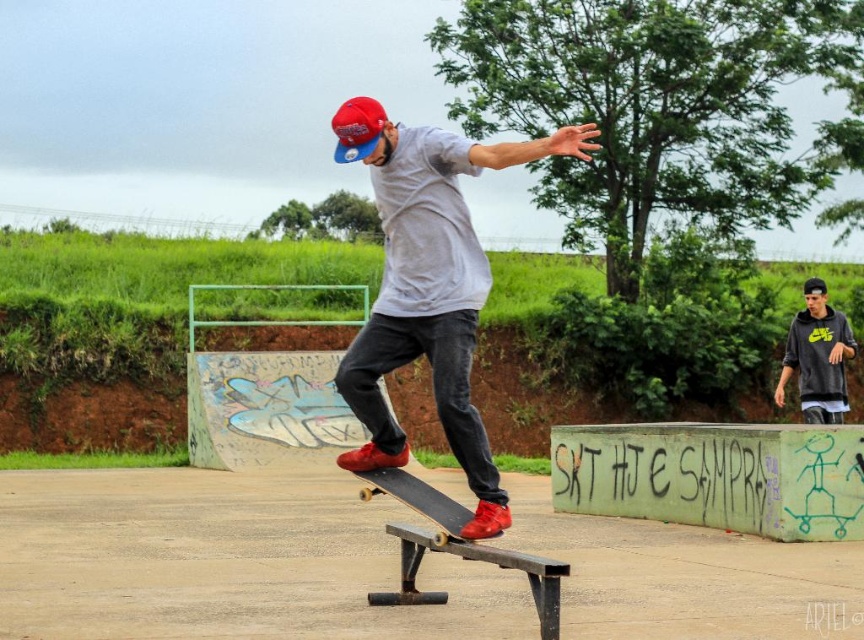
Does matte red sneakers at center appear over dark gray hoodie at right?

Yes, matte red sneakers at center is above dark gray hoodie at right.

Who is shorter, matte red sneakers at center or dark gray hoodie at right?

dark gray hoodie at right is shorter.

Identify the location of matte red sneakers at center. (429, 285).

Does point (461, 371) lie in front of point (454, 502)?

That is True.

Which is in front, point (408, 301) or point (446, 496)?

Point (408, 301)

Who is more distant from viewer, (x=359, y=413) or (x=422, y=512)?

The point (x=422, y=512) is behind.

Image resolution: width=864 pixels, height=640 pixels. In order to click on matte red sneakers at center in this screenshot , I will do `click(429, 285)`.

Who is positioned more to the left, dark gray hoodie at right or black matte skateboard at center?

Positioned to the left is black matte skateboard at center.

Can you confirm if dark gray hoodie at right is taller than black matte skateboard at center?

Correct, dark gray hoodie at right is much taller as black matte skateboard at center.

Is point (823, 378) positioned in front of point (421, 497)?

No, (823, 378) is behind (421, 497).

Locate an element on the screen. dark gray hoodie at right is located at coordinates (817, 356).